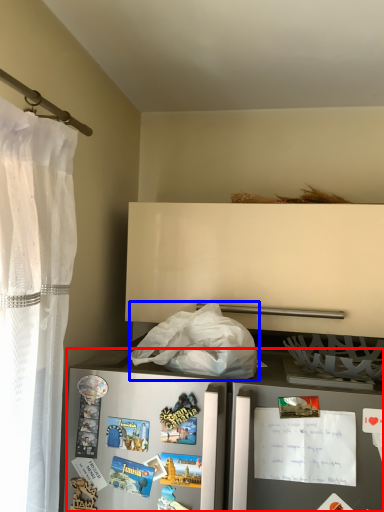
Question: Which object is closer to the camera taking this photo, refrigerator (highlighted by a red box) or plastic bag (highlighted by a blue box)?

Choices:
 (A) refrigerator
 (B) plastic bag

Answer: (A)